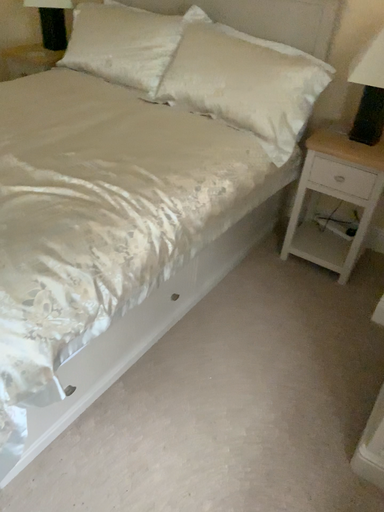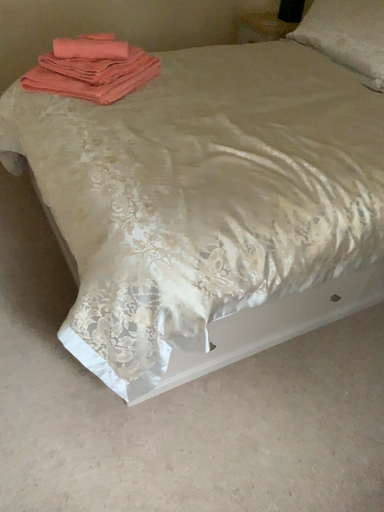
Question: Which way did the camera rotate in the video?

Choices:
 (A) rotated left
 (B) rotated right

Answer: (A)